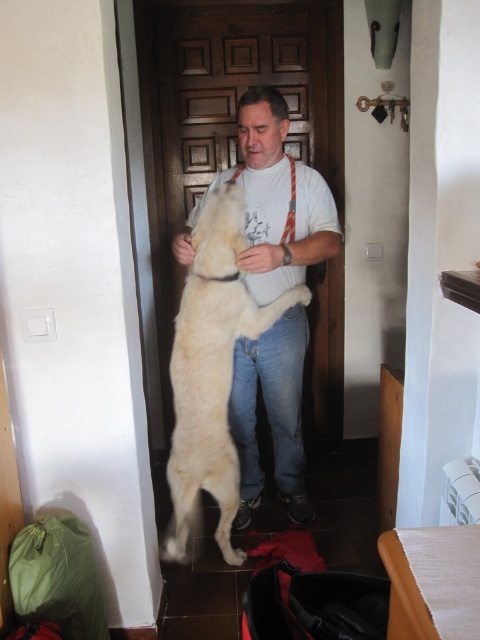
Question: Which object is closer to the camera taking this photo?

Choices:
 (A) beige fabric lift at lower right
 (B) light beige fur at center

Answer: (A)

Question: Observing the image, what is the correct spatial positioning of light beige fur at center in reference to beige fabric lift at lower right?

Choices:
 (A) left
 (B) right

Answer: (A)

Question: Can you confirm if light beige fur at center is positioned above beige fabric lift at lower right?

Choices:
 (A) yes
 (B) no

Answer: (A)

Question: Among these objects, which one is farthest from the camera?

Choices:
 (A) light beige fur at center
 (B) beige fabric lift at lower right

Answer: (A)

Question: Is light beige fur at center positioned in front of beige fabric lift at lower right?

Choices:
 (A) yes
 (B) no

Answer: (B)